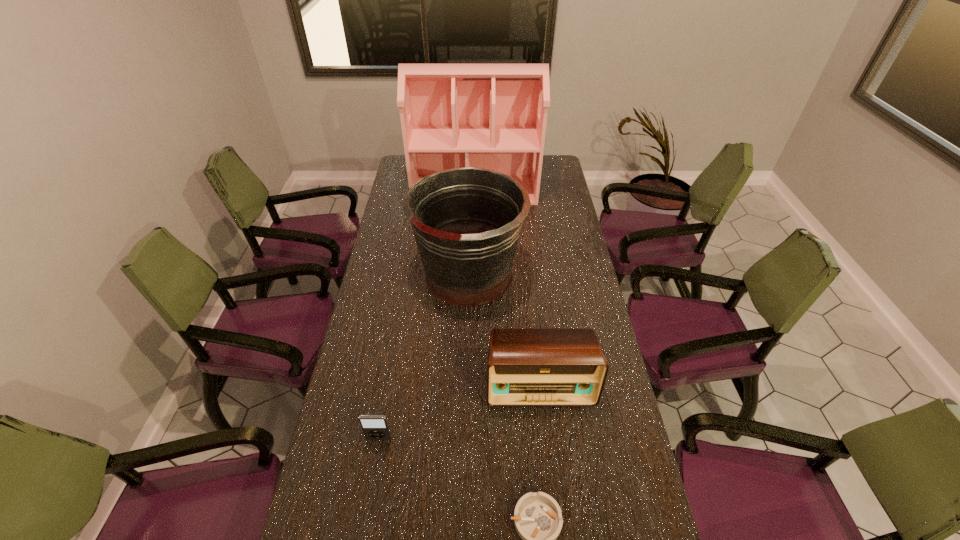
Image resolution: width=960 pixels, height=540 pixels. In order to click on free region at the left edge of the desktop in this screenshot , I will do `click(348, 360)`.

Locate an element on the screen. The image size is (960, 540). vacant space at the right edge is located at coordinates (600, 443).

Where is `vacant space at the far right corner of the desktop`? vacant space at the far right corner of the desktop is located at coordinates (551, 166).

Identify which object is the third closest to the second tallest object. Please provide its 2D coordinates. Your answer should be formatted as a tuple, i.e. [(x, y)], where the tuple contains the x and y coordinates of a point satisfying the conditions above.

[(375, 427)]

You are a GUI agent. You are given a task and a screenshot of the screen. Output one action in this format:
    pyautogui.click(x=<x>, y=<y>)
    Task: Click on the fourth closest object to the nearest object
    Image resolution: width=960 pixels, height=540 pixels.
    Given the screenshot: What is the action you would take?
    pyautogui.click(x=493, y=116)